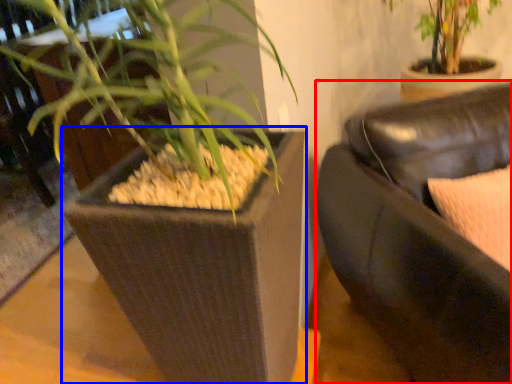
Question: Which point is closer to the camera, studio couch (highlighted by a red box) or flowerpot (highlighted by a blue box)?

Choices:
 (A) studio couch
 (B) flowerpot

Answer: (A)